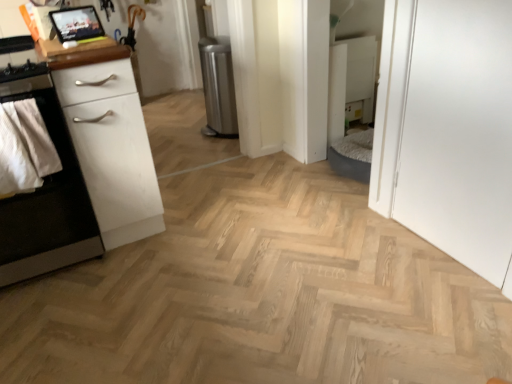
What are the coordinates of `free location in front of metallic trash can at center, the second appliance in the front-to-back sequence` in the screenshot? It's located at (215, 147).